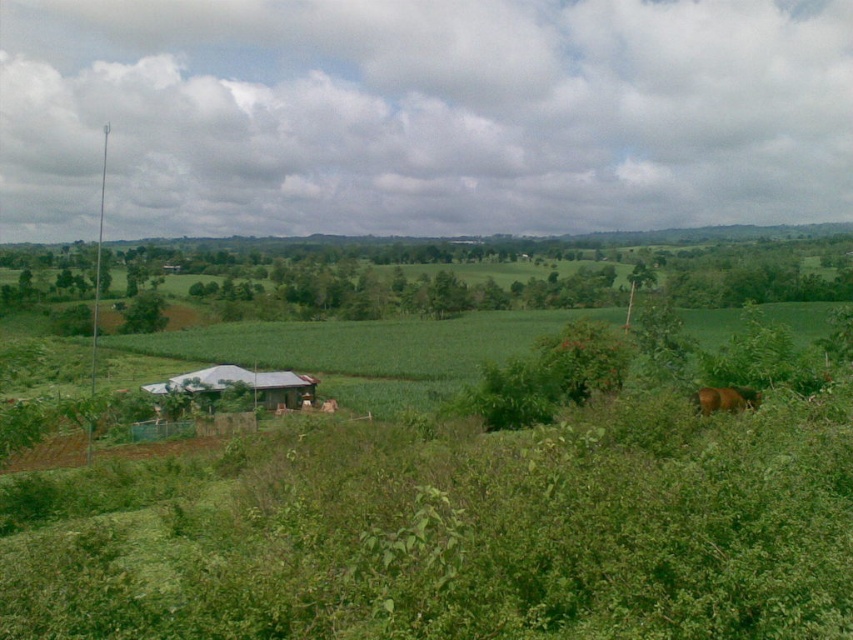
Question: Which point is closer to the camera?

Choices:
 (A) metallic gray hut at lower left
 (B) brown furry horse at lower right

Answer: (B)

Question: Which object is farther from the camera taking this photo?

Choices:
 (A) brown furry horse at lower right
 (B) metallic gray hut at lower left

Answer: (B)

Question: Does metallic gray hut at lower left have a larger size compared to brown furry horse at lower right?

Choices:
 (A) yes
 (B) no

Answer: (A)

Question: Considering the relative positions of metallic gray hut at lower left and brown furry horse at lower right in the image provided, where is metallic gray hut at lower left located with respect to brown furry horse at lower right?

Choices:
 (A) left
 (B) right

Answer: (A)

Question: Can you confirm if metallic gray hut at lower left is smaller than brown furry horse at lower right?

Choices:
 (A) yes
 (B) no

Answer: (B)